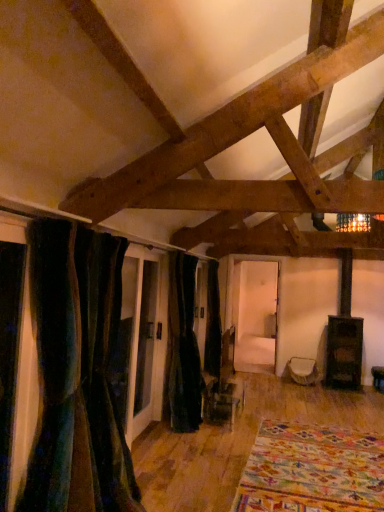
Question: Is white fabric ottoman at center surrounding velvet dark green curtain at center, which is counted as the first curtain, starting from the back?

Choices:
 (A) yes
 (B) no

Answer: (B)

Question: Does white fabric ottoman at center appear on the right side of velvet dark green curtain at center, which is counted as the first curtain, starting from the back?

Choices:
 (A) yes
 (B) no

Answer: (A)

Question: From the image's perspective, would you say white fabric ottoman at center is shown under velvet dark green curtain at center, the 2th curtain in the front-to-back sequence?

Choices:
 (A) yes
 (B) no

Answer: (A)

Question: Considering the relative positions of white fabric ottoman at center and velvet dark green curtain at center, the 2th curtain in the front-to-back sequence, in the image provided, is white fabric ottoman at center behind velvet dark green curtain at center, the 2th curtain in the front-to-back sequence,?

Choices:
 (A) yes
 (B) no

Answer: (A)

Question: Does white fabric ottoman at center come in front of velvet dark green curtain at center, which is counted as the first curtain, starting from the back?

Choices:
 (A) no
 (B) yes

Answer: (A)

Question: From the image's perspective, does white fabric ottoman at center appear higher than velvet dark green curtain at center, the 2th curtain in the front-to-back sequence?

Choices:
 (A) yes
 (B) no

Answer: (B)

Question: From the image's perspective, does velvet dark green curtain at center, which is counted as the first curtain, starting from the back, appear lower than white fabric ottoman at center?

Choices:
 (A) no
 (B) yes

Answer: (A)

Question: From a real-world perspective, is velvet dark green curtain at center, which is counted as the first curtain, starting from the back, located higher than white fabric ottoman at center?

Choices:
 (A) yes
 (B) no

Answer: (A)

Question: Does velvet dark green curtain at center, the 2th curtain in the front-to-back sequence, appear on the right side of white fabric ottoman at center?

Choices:
 (A) no
 (B) yes

Answer: (A)

Question: Does velvet dark green curtain at center, which is counted as the first curtain, starting from the back, have a greater height compared to white fabric ottoman at center?

Choices:
 (A) yes
 (B) no

Answer: (A)

Question: Considering the relative sizes of velvet dark green curtain at center, the 2th curtain in the front-to-back sequence, and white fabric ottoman at center in the image provided, is velvet dark green curtain at center, the 2th curtain in the front-to-back sequence, bigger than white fabric ottoman at center?

Choices:
 (A) yes
 (B) no

Answer: (A)

Question: Is velvet dark green curtain at center, the 2th curtain in the front-to-back sequence, next to white fabric ottoman at center and touching it?

Choices:
 (A) yes
 (B) no

Answer: (B)

Question: From the image's perspective, does multicolored woven rug at lower right appear lower than white fabric ottoman at center?

Choices:
 (A) yes
 (B) no

Answer: (A)